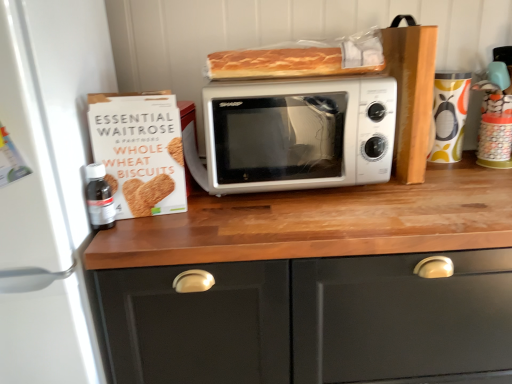
Identify the location of spots to the right of white cardboard box at left. (224, 221).